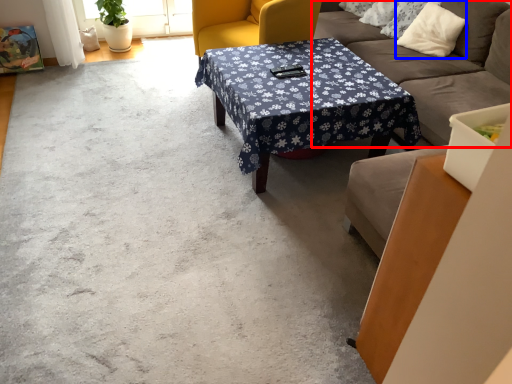
Question: Among these objects, which one is nearest to the camera, studio couch (highlighted by a red box) or pillow (highlighted by a blue box)?

Choices:
 (A) studio couch
 (B) pillow

Answer: (A)